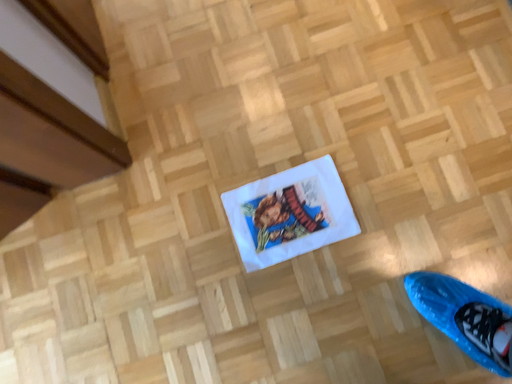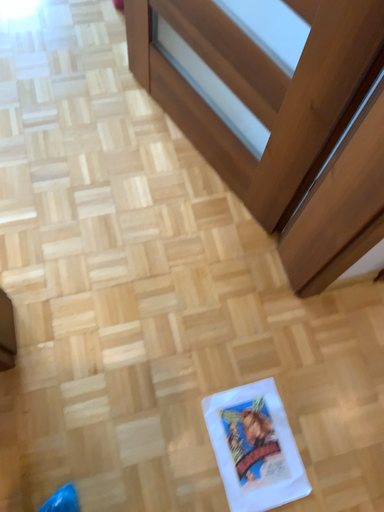
Question: How did the camera likely rotate when shooting the video?

Choices:
 (A) rotated right
 (B) rotated left

Answer: (B)